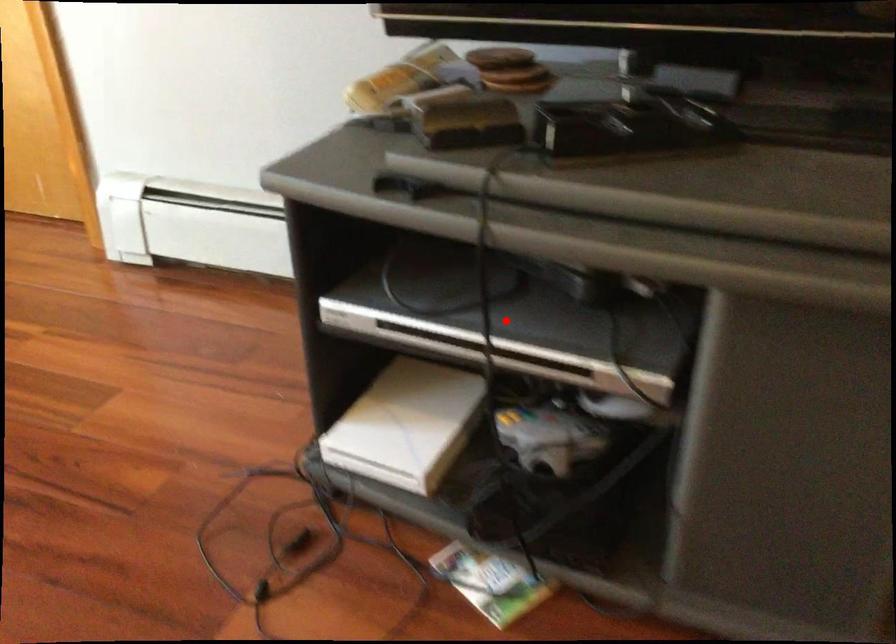
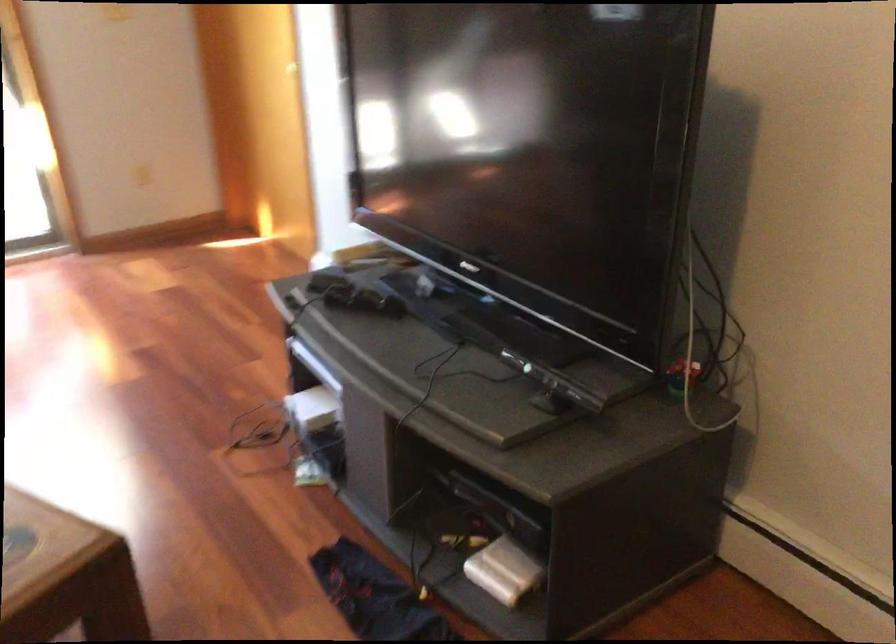
Question: I am providing you with two images of the same scene from different viewpoints. A red point is marked on the first image. At the location where the point appears in image 1, is it still visible in image 2?

Choices:
 (A) Yes
 (B) No

Answer: (B)